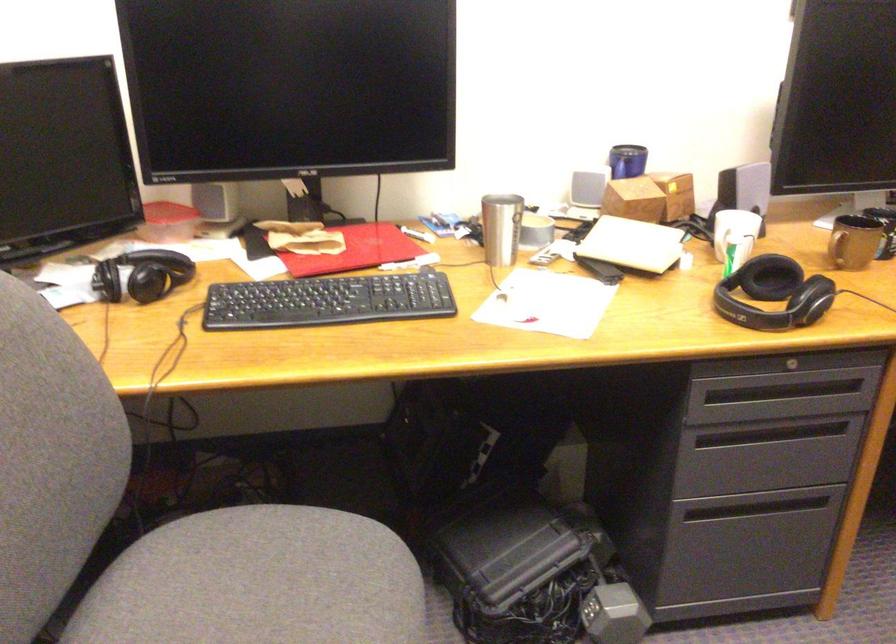
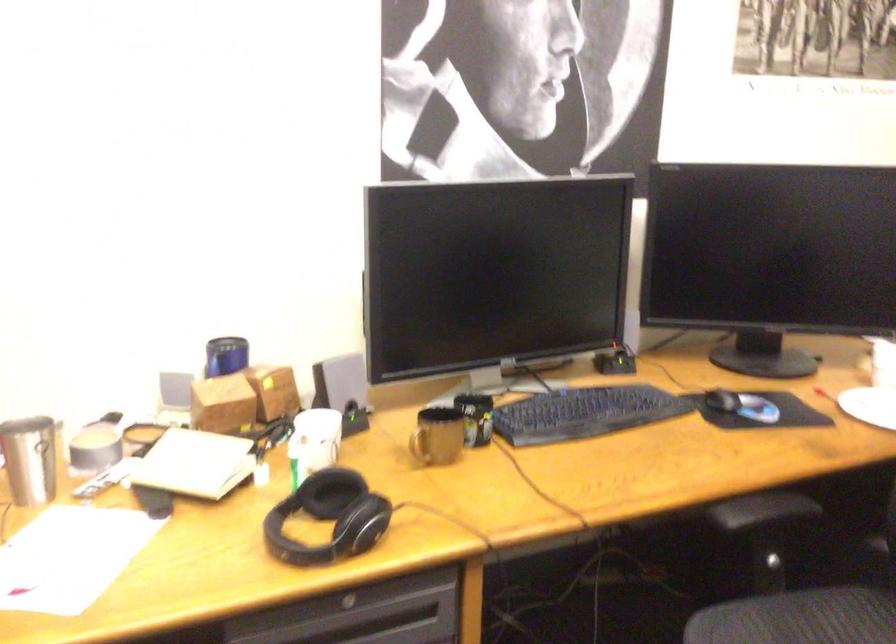
Find the pixel in the second image that matches point (676, 187) in the first image.

(272, 392)